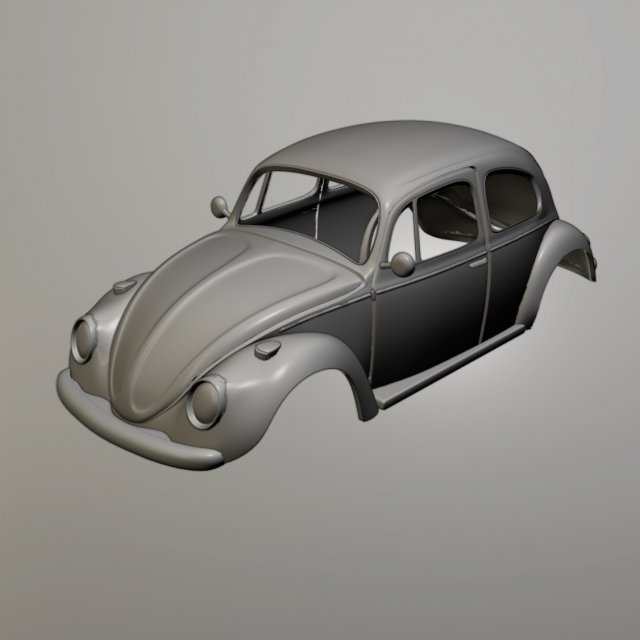
Where is `windows`? The width and height of the screenshot is (640, 640). windows is located at coordinates (436, 248), (408, 228), (514, 189), (340, 212), (298, 182), (259, 196).